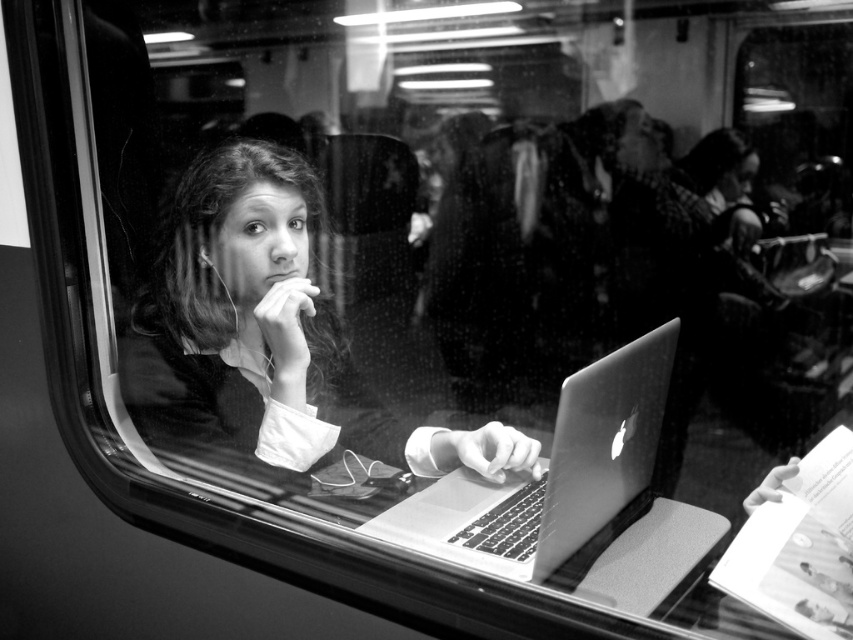
You are inside a train and want to place a small object exactly halfway between point (335,419) and point (581,502). Will the object be closer to the window or the seat?

The halfway point between point (335,419) and point (581,502) is closer to the window because point (335,419) is behind point (581,502), meaning it is further away from the window. Therefore, the midpoint leans towards the window side.

Based on the coordinates provided in the scene description, where exactly is the smooth skin girl at center located?

The smooth skin girl at center is located at point (268, 332).